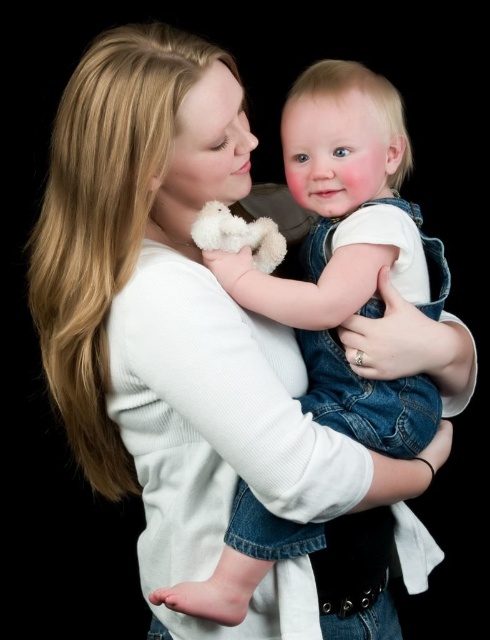
Which of these two, denim overalls at center or white plush teddy bear at center, stands shorter?

white plush teddy bear at center

Can you confirm if denim overalls at center is positioned above white plush teddy bear at center?

Actually, denim overalls at center is below white plush teddy bear at center.

Locate an element on the screen. The image size is (490, 640). denim overalls at center is located at coordinates (347, 248).